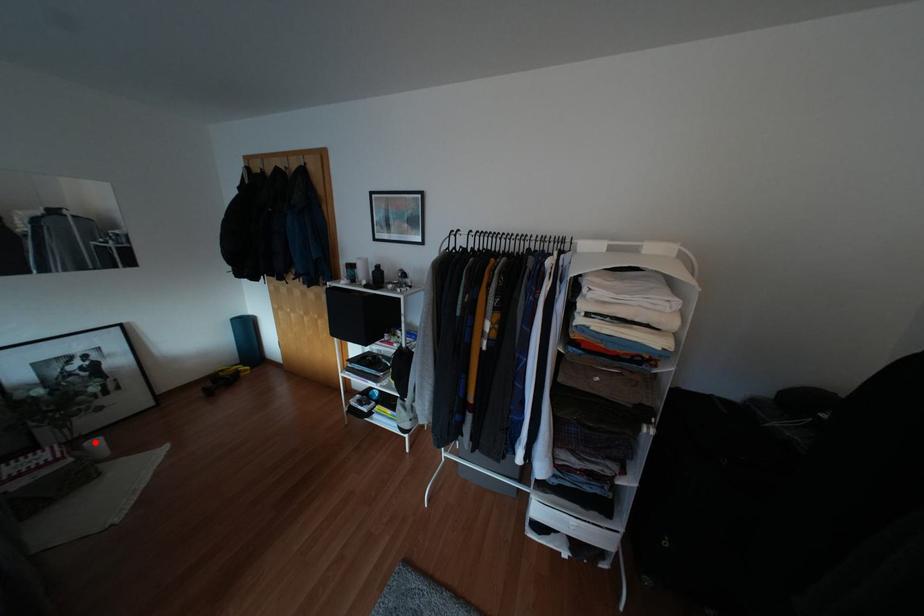
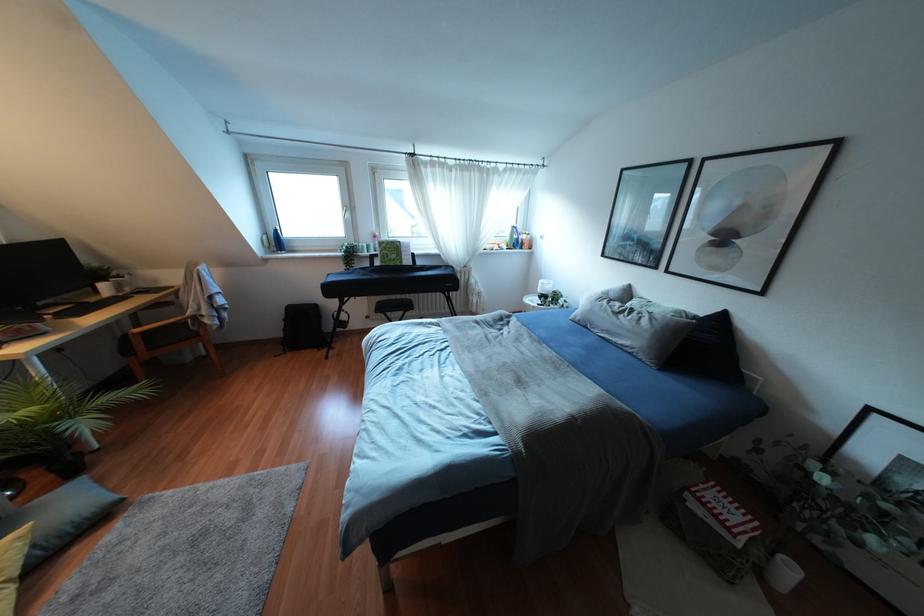
Question: I am providing you with two images of the same scene from different viewpoints. A red point is marked on the first image. Can you still see the location of the red point in image 2?

Choices:
 (A) Yes
 (B) No

Answer: (A)